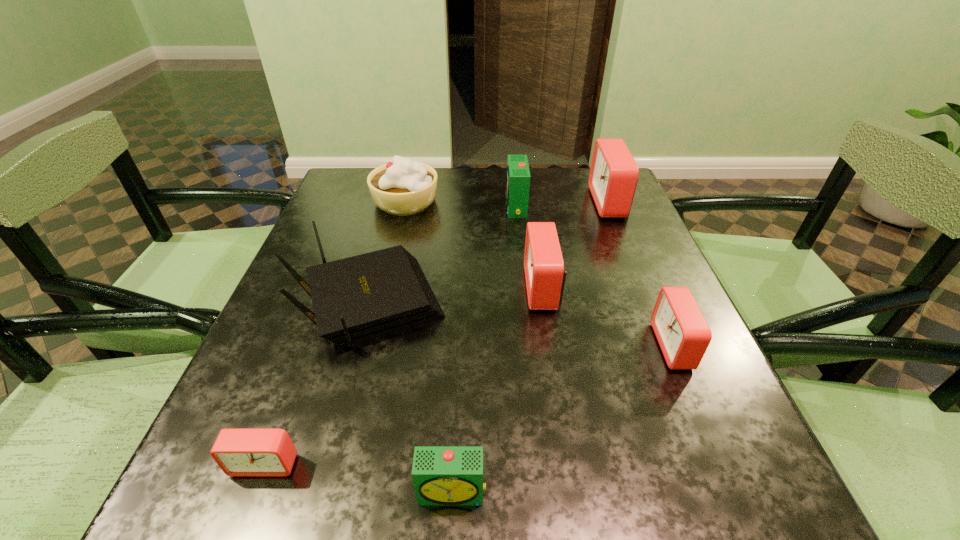
What are the coordinates of `vacant region at the far right corner of the desktop` in the screenshot? It's located at (588, 187).

This screenshot has height=540, width=960. In the image, there is a desktop. What are the coordinates of `blank space at the near right corner` in the screenshot? It's located at (674, 507).

Locate an element on the screen. This screenshot has height=540, width=960. vacant area that lies between the smaller green alarm clock and the shortest object is located at coordinates (359, 478).

Where is `empty location between the nearer green alarm clock and the leftmost red alarm clock`? The image size is (960, 540). empty location between the nearer green alarm clock and the leftmost red alarm clock is located at coordinates (359, 478).

Identify the location of vacant point located between the second nearest red alarm clock and the third red alarm clock from right to left. (609, 317).

Where is `vacant point located between the tallest alarm clock and the left green alarm clock`? vacant point located between the tallest alarm clock and the left green alarm clock is located at coordinates (531, 347).

This screenshot has width=960, height=540. I want to click on blank region between the farthest red alarm clock and the right green alarm clock, so click(x=563, y=205).

You are a GUI agent. You are given a task and a screenshot of the screen. Output one action in this format:
    pyautogui.click(x=<x>, y=<y>)
    Task: Click on the empty location between the beige whipped cream and the farther green alarm clock
    
    Given the screenshot: What is the action you would take?
    pyautogui.click(x=461, y=204)

You are a GUI agent. You are given a task and a screenshot of the screen. Output one action in this format:
    pyautogui.click(x=<x>, y=<y>)
    Task: Click on the vacant area that lies between the third nearest red alarm clock and the tallest alarm clock
    Image resolution: width=960 pixels, height=540 pixels.
    Given the screenshot: What is the action you would take?
    pyautogui.click(x=576, y=245)

You are a GUI agent. You are given a task and a screenshot of the screen. Output one action in this format:
    pyautogui.click(x=<x>, y=<y>)
    Task: Click on the empty space that is in between the router and the farther green alarm clock
    This screenshot has width=960, height=540.
    Given the screenshot: What is the action you would take?
    pyautogui.click(x=443, y=256)